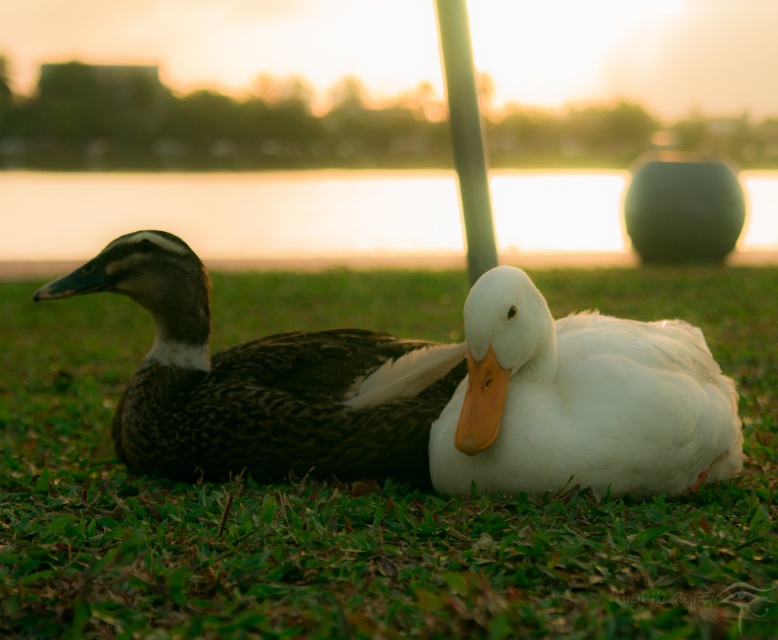
From the picture: Can you confirm if green grass at center is smaller than white glossy pole at center?

Correct, green grass at center occupies less space than white glossy pole at center.

Is green grass at center below white glossy pole at center?

Indeed, green grass at center is positioned under white glossy pole at center.

At what (x,y) coordinates should I click in order to perform the action: click on green grass at center. Please return your answer as a coordinate pair (x, y). This screenshot has width=778, height=640. Looking at the image, I should click on (370, 506).

I want to click on green grass at center, so click(x=370, y=506).

Looking at this image, is white matte duck at center shorter than dark brown feathers at center?

Correct, white matte duck at center is not as tall as dark brown feathers at center.

Can you confirm if white matte duck at center is positioned to the right of dark brown feathers at center?

Yes, white matte duck at center is to the right of dark brown feathers at center.

Identify the location of white matte duck at center. This screenshot has height=640, width=778. (569, 400).

Can you confirm if green grass at center is positioned below white matte duck at center?

Correct, green grass at center is located below white matte duck at center.

Where is `green grass at center`? green grass at center is located at coordinates (370, 506).